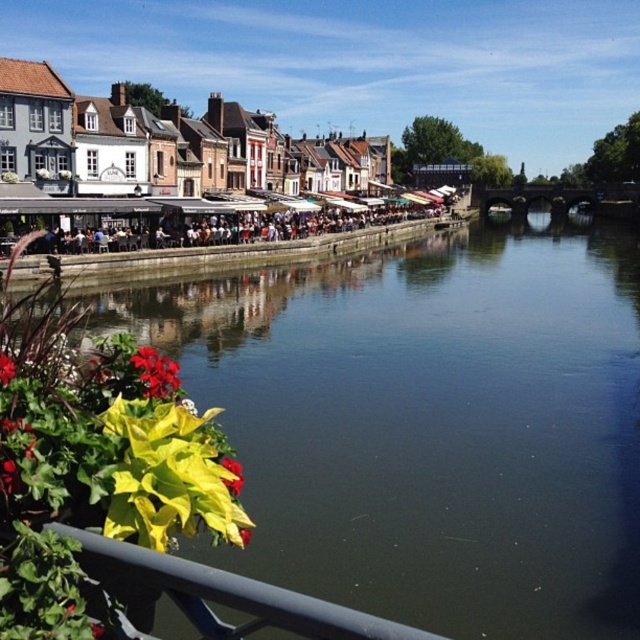
Question: Which of the following is the closest to the observer?

Choices:
 (A) red matte flower at lower left
 (B) vivid red petals at lower left
 (C) greenish-brown water at center

Answer: (A)

Question: Is greenish-brown water at center smaller than vivid red petals at lower left?

Choices:
 (A) yes
 (B) no

Answer: (B)

Question: Which object is the closest to the greenish-brown water at center?

Choices:
 (A) red matte flower at lower left
 (B) vivid red petals at lower left

Answer: (B)

Question: Which object is farther from the camera taking this photo?

Choices:
 (A) red matte flower at lower left
 (B) yellow-green leaf at lower left
 (C) greenish-brown water at center

Answer: (C)

Question: Does greenish-brown water at center lie in front of red matte flower at lower left?

Choices:
 (A) yes
 (B) no

Answer: (B)

Question: Can you confirm if yellow-green leaf at lower left is thinner than red matte flower at lower left?

Choices:
 (A) no
 (B) yes

Answer: (A)